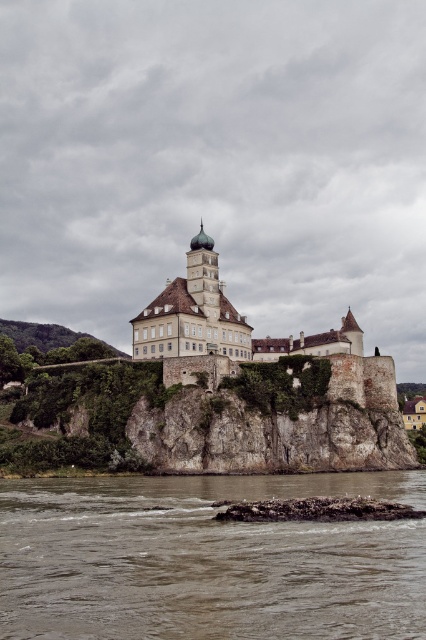
Looking at this image, you are a landscape architect designing a garden path that needs to pass between the brown sedimentary rock at lower center and the white stone castle at center. The path must be wide enough for a wheelbarrow. Can you determine if the space between them is sufficient?

The brown sedimentary rock at lower center is larger than the white stone castle at center. However, the exact distance between them isn generated in the provided information. Without knowing the actual spacing, it is impossible to confirm if the path will accommodate a wheelbarrow.

You are a tour guide leading a group to the white stone castle at center. Your group is currently standing on the brown sedimentary rock at lower center. The path between them is rocky and uneven. If your group moves at a slow walking pace of 1.5 meters per second, how many seconds will it take to reach the castle?

The distance between the brown sedimentary rock at lower center and the white stone castle at center is 39.17 meters. At a speed of 1.5 meters per second, the time required is 39.17 divided by 1.5, which equals approximately 26.11 seconds. Therefore, it will take about 26 seconds to reach the castle.